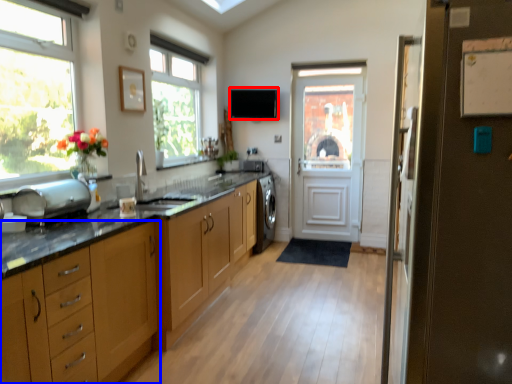
Question: Which of the following is the closest to the observer, exhaust hood (highlighted by a red box) or cabinetry (highlighted by a blue box)?

Choices:
 (A) exhaust hood
 (B) cabinetry

Answer: (B)